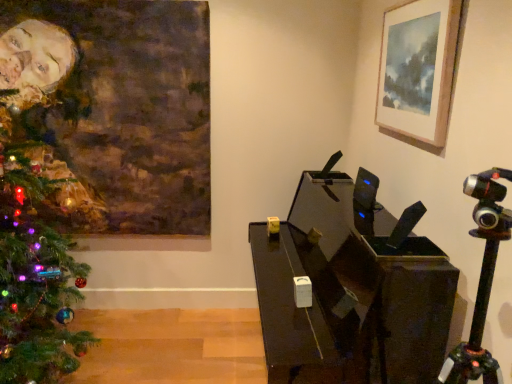
Question: Is green matte christmas tree at left taller or shorter than oil painting portrait at left, the 2th picture frame in the right-to-left sequence?

Choices:
 (A) tall
 (B) short

Answer: (A)

Question: Does point (41, 200) appear closer or farther from the camera than point (58, 117)?

Choices:
 (A) farther
 (B) closer

Answer: (B)

Question: Which of these objects is positioned farthest from the green matte christmas tree at left?

Choices:
 (A) wooden picture frame at upper right, the 2th picture frame positioned from the left
 (B) oil painting portrait at left, the first picture frame in the back-to-front sequence

Answer: (A)

Question: Which object is the farthest from the oil painting portrait at left, which appears as the second picture frame when viewed from the front?

Choices:
 (A) green matte christmas tree at left
 (B) wooden picture frame at upper right, placed as the 2th picture frame when sorted from back to front

Answer: (B)